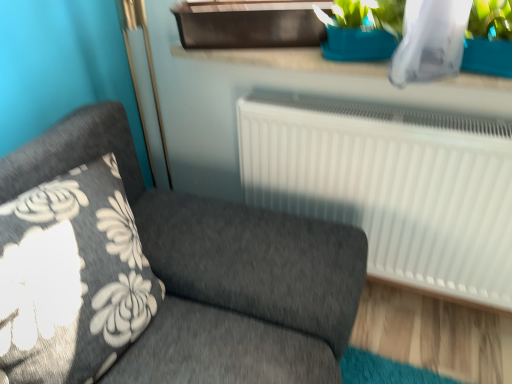
Question: From their relative heights in the image, would you say dark gray fabric couch at left is taller or shorter than blue plastic window sill at upper center?

Choices:
 (A) tall
 (B) short

Answer: (A)

Question: Would you say dark gray fabric couch at left is to the left or to the right of blue plastic window sill at upper center in the picture?

Choices:
 (A) left
 (B) right

Answer: (A)

Question: From the image's perspective, is dark gray fabric couch at left above or below blue plastic window sill at upper center?

Choices:
 (A) below
 (B) above

Answer: (A)

Question: Looking at their shapes, would you say blue plastic window sill at upper center is wider or thinner than dark gray fabric couch at left?

Choices:
 (A) thin
 (B) wide

Answer: (A)

Question: Based on their sizes in the image, would you say blue plastic window sill at upper center is bigger or smaller than dark gray fabric couch at left?

Choices:
 (A) big
 (B) small

Answer: (B)

Question: Is blue plastic window sill at upper center in front of or behind dark gray fabric couch at left in the image?

Choices:
 (A) front
 (B) behind

Answer: (B)

Question: From a real-world perspective, relative to dark gray fabric couch at left, is blue plastic window sill at upper center vertically above or below?

Choices:
 (A) above
 (B) below

Answer: (A)